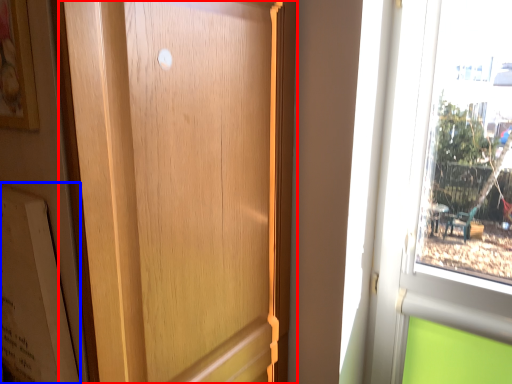
Question: Which object is further to the camera taking this photo, door (highlighted by a red box) or bulletin board (highlighted by a blue box)?

Choices:
 (A) door
 (B) bulletin board

Answer: (B)